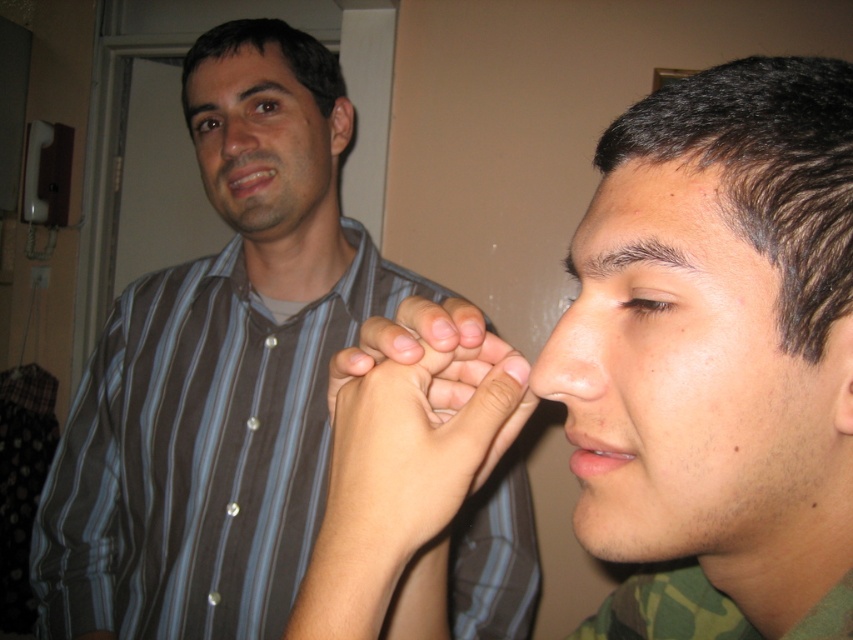
Question: Does smooth skin nose at center have a larger size compared to matte brown forehead at upper left?

Choices:
 (A) yes
 (B) no

Answer: (B)

Question: Estimate the real-world distances between objects in this image. Which object is closer to the smooth skin nose at center?

Choices:
 (A) matte brown shirt at upper left
 (B) smooth skin face at right
 (C) matte striped shirt at center
 (D) matte skin nose at center

Answer: (B)

Question: Among these points, which one is farthest from the camera?

Choices:
 (A) (374, 579)
 (B) (196, 145)
 (C) (811, 410)
 (D) (186, 81)

Answer: (D)

Question: Which point is closer to the camera?

Choices:
 (A) (294, 36)
 (B) (257, 138)
 (C) (567, 328)
 (D) (612, 561)

Answer: (C)

Question: Is smooth skin hand at center below matte brown shirt at upper left?

Choices:
 (A) no
 (B) yes

Answer: (B)

Question: Is striped cotton shirt at left to the right of smooth skin hand at center from the viewer's perspective?

Choices:
 (A) yes
 (B) no

Answer: (B)